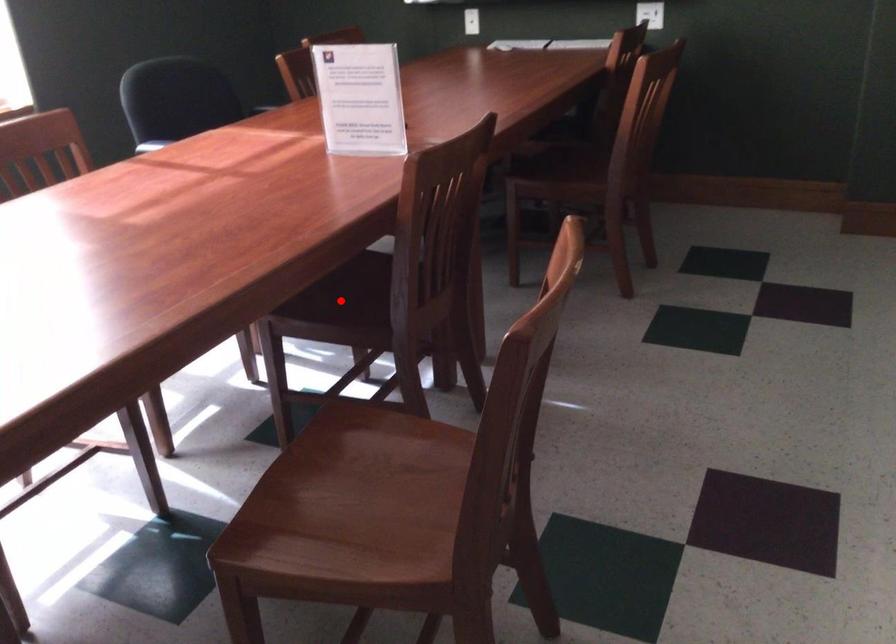
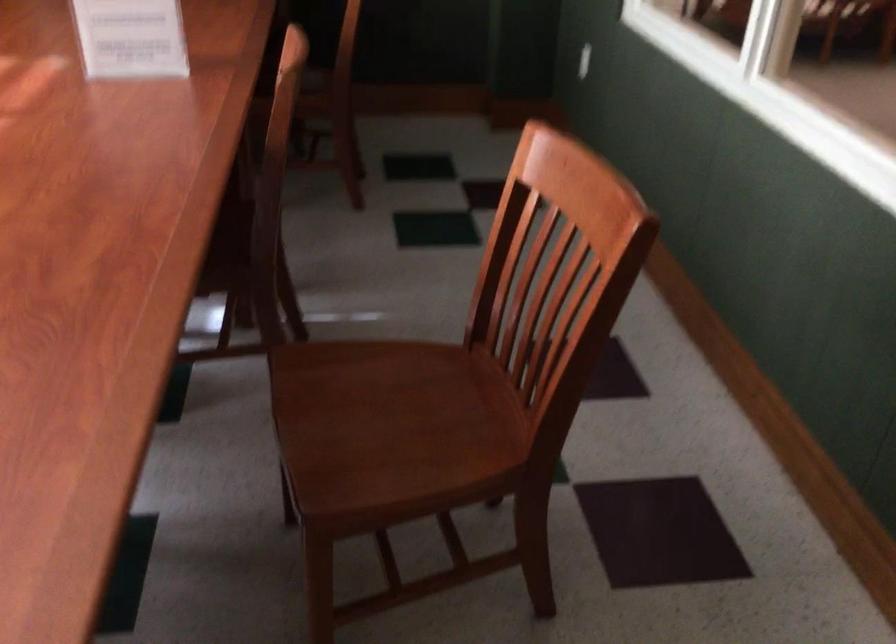
Question: I am providing you with two images of the same scene from different viewpoints. A red point is marked on the first image. At the location where the point appears in image 1, is it still visible in image 2?

Choices:
 (A) Yes
 (B) No

Answer: (B)